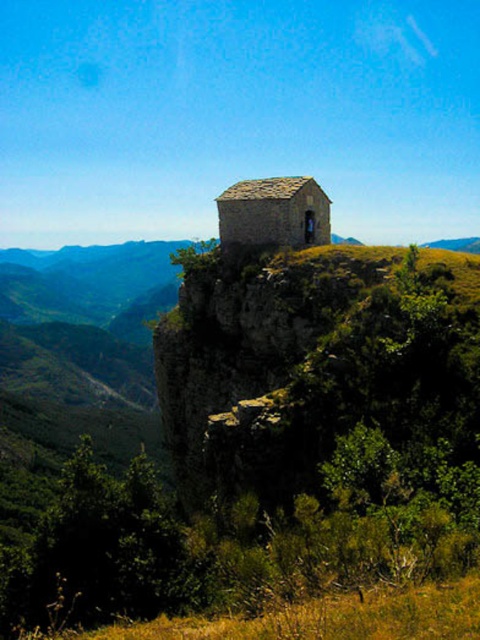
You are standing at the bottom of the cliff looking up at the scene. Which direction should you look to find the brown rough rock at upper center?

Answer: The brown rough rock at upper center is located at the upper center of the image, so you should look upward and towards the center to find it.

You are a hiker who wants to place a 1.5 meter wide tent between the brown rough rock at upper center and the stone textured hut at center. Can you fit it there?

The brown rough rock at upper center might be wider than the stone textured hut at center, but since the exact width isn t specified, it s uncertain if the 1.5 meter tent will fit. Check the actual distance before deciding.